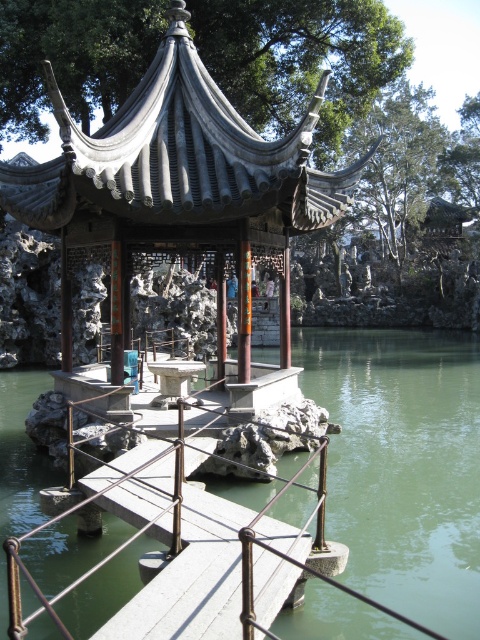
From the picture: You are standing in front of the traditional Chinese pavilion and want to know the distance to the point marked at coordinates point [321,192]. Can you estimate how far it is from your current position?

The point [321,192] is 45.75 feet away from the viewer.